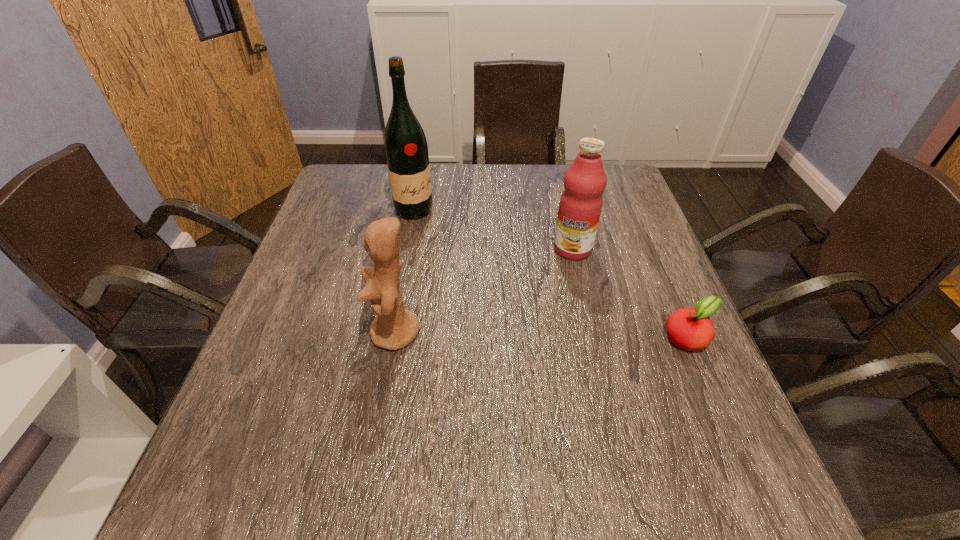
Find the location of a particular element. The width and height of the screenshot is (960, 540). free space on the desktop that is between the figurine and the shortest object and is positioned on the front-facing side of the liquor is located at coordinates (559, 335).

Where is `vacant space on the desktop that is between the figurine and the apple and is positioned on the label of the third object from left to right`? This screenshot has width=960, height=540. vacant space on the desktop that is between the figurine and the apple and is positioned on the label of the third object from left to right is located at coordinates (528, 335).